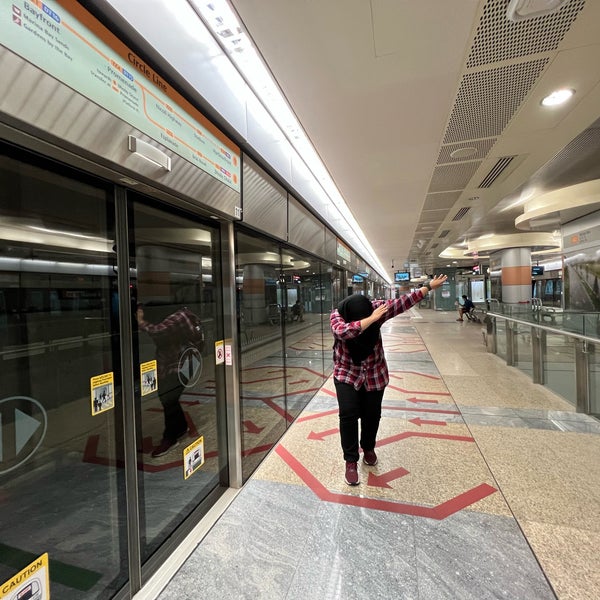
Identify the location of window. The image size is (600, 600). (66, 335), (172, 315), (254, 312), (266, 370), (311, 350), (298, 303), (329, 287), (328, 340).